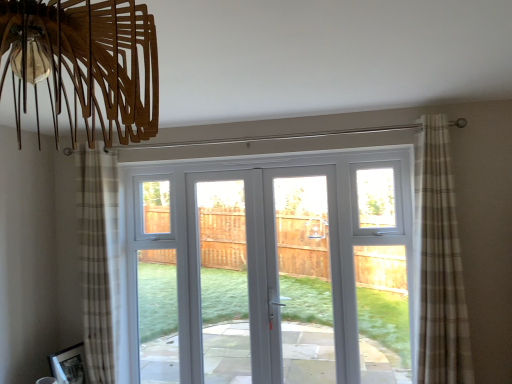
Where is `beige plaid curtain at left, the 1th curtain positioned from the back`? This screenshot has height=384, width=512. beige plaid curtain at left, the 1th curtain positioned from the back is located at coordinates (99, 259).

What is the approximate width of beige plaid curtain at right, arranged as the 2th curtain when viewed from the back?

beige plaid curtain at right, arranged as the 2th curtain when viewed from the back, is 10.49 inches wide.

Locate an element on the screen. The image size is (512, 384). white glossy door at center is located at coordinates (270, 269).

Which is correct: beige plaid curtain at right, positioned as the second curtain in left-to-right order, is inside beige plaid curtain at left, the first curtain positioned from the left, or outside of it?

beige plaid curtain at right, positioned as the second curtain in left-to-right order, is outside beige plaid curtain at left, the first curtain positioned from the left.

In the image, is beige plaid curtain at right, arranged as the 2th curtain when viewed from the back, positioned in front of or behind beige plaid curtain at left, which ranks as the 2th curtain in right-to-left order?

In the image, beige plaid curtain at right, arranged as the 2th curtain when viewed from the back, appears in front of beige plaid curtain at left, which ranks as the 2th curtain in right-to-left order.

Can you confirm if beige plaid curtain at right, arranged as the 2th curtain when viewed from the back, is positioned to the left of beige plaid curtain at left, which ranks as the 2th curtain in right-to-left order?

No, beige plaid curtain at right, arranged as the 2th curtain when viewed from the back, is not to the left of beige plaid curtain at left, which ranks as the 2th curtain in right-to-left order.

Considering the relative sizes of beige plaid curtain at right, acting as the first curtain starting from the front, and white glossy door at center in the image provided, is beige plaid curtain at right, acting as the first curtain starting from the front, smaller than white glossy door at center?

Yes, beige plaid curtain at right, acting as the first curtain starting from the front, is smaller than white glossy door at center.

From the picture: Can you confirm if beige plaid curtain at right, acting as the first curtain starting from the front, is thinner than white glossy door at center?

No, beige plaid curtain at right, acting as the first curtain starting from the front, is not thinner than white glossy door at center.

Between beige plaid curtain at right, arranged as the 2th curtain when viewed from the back, and white glossy door at center, which one appears on the right side from the viewer's perspective?

From the viewer's perspective, beige plaid curtain at right, arranged as the 2th curtain when viewed from the back, appears more on the right side.

Can beige plaid curtain at right, acting as the first curtain starting from the front, be found inside white glossy door at center?

No, beige plaid curtain at right, acting as the first curtain starting from the front, is located outside of white glossy door at center.

I want to click on door below the beige plaid curtain at right, arranged as the 2th curtain when viewed from the back (from a real-world perspective), so (x=270, y=269).

Is point (337, 219) closer to viewer compared to point (426, 249)?

No, it is behind (426, 249).

In the scene shown: Is white glossy door at center aimed at beige plaid curtain at left, the 2th curtain viewed from the front?

Yes, white glossy door at center is turned towards beige plaid curtain at left, the 2th curtain viewed from the front.

Considering the relative positions of white glossy door at center and beige plaid curtain at left, the first curtain positioned from the left, in the image provided, is white glossy door at center behind beige plaid curtain at left, the first curtain positioned from the left,?

Yes, it is.

Between white glossy door at center and beige plaid curtain at left, which ranks as the 2th curtain in right-to-left order, which one has larger size?

Bigger between the two is white glossy door at center.

Can you tell me how much beige plaid curtain at left, the 2th curtain viewed from the front, and white glossy door at center differ in facing direction?

The facing directions of beige plaid curtain at left, the 2th curtain viewed from the front, and white glossy door at center are 0.403 degrees apart.

Is point (106, 250) behind point (347, 310)?

No, it is not.

From the picture: Is beige plaid curtain at left, the first curtain positioned from the left, in front of or behind white glossy door at center in the image?

In the image, beige plaid curtain at left, the first curtain positioned from the left, appears in front of white glossy door at center.

Could you tell me if beige plaid curtain at left, which ranks as the 2th curtain in right-to-left order, is facing white glossy door at center?

No, beige plaid curtain at left, which ranks as the 2th curtain in right-to-left order, is not aimed at white glossy door at center.

Is beige plaid curtain at left, which ranks as the 2th curtain in right-to-left order, not close to beige plaid curtain at right, positioned as the second curtain in left-to-right order?

Indeed, beige plaid curtain at left, which ranks as the 2th curtain in right-to-left order, is not near beige plaid curtain at right, positioned as the second curtain in left-to-right order.

Could beige plaid curtain at right, which is counted as the first curtain, starting from the right, be considered to be inside beige plaid curtain at left, which ranks as the 2th curtain in right-to-left order?

Actually, beige plaid curtain at right, which is counted as the first curtain, starting from the right, is outside beige plaid curtain at left, which ranks as the 2th curtain in right-to-left order.

Visually, is beige plaid curtain at left, which ranks as the 2th curtain in right-to-left order, positioned to the left or to the right of beige plaid curtain at right, arranged as the 2th curtain when viewed from the back?

In the image, beige plaid curtain at left, which ranks as the 2th curtain in right-to-left order, appears on the left side of beige plaid curtain at right, arranged as the 2th curtain when viewed from the back.

This screenshot has width=512, height=384. I want to click on curtain that is in front of the beige plaid curtain at left, the 2th curtain viewed from the front, so click(439, 262).

Identify the location of door located on the left of beige plaid curtain at right, arranged as the 2th curtain when viewed from the back. (270, 269).

Estimate the real-world distances between objects in this image. Which object is closer to beige plaid curtain at right, acting as the first curtain starting from the front, beige plaid curtain at left, the 1th curtain positioned from the back, or white glossy door at center?

beige plaid curtain at left, the 1th curtain positioned from the back, lies closer to beige plaid curtain at right, acting as the first curtain starting from the front, than the other object.

Looking at the image, which one is located further to beige plaid curtain at left, the 2th curtain viewed from the front, beige plaid curtain at right, positioned as the second curtain in left-to-right order, or white glossy door at center?

white glossy door at center is further to beige plaid curtain at left, the 2th curtain viewed from the front.

Considering their positions, is beige plaid curtain at right, positioned as the second curtain in left-to-right order, positioned closer to white glossy door at center than beige plaid curtain at left, the first curtain positioned from the left?

Among the two, beige plaid curtain at right, positioned as the second curtain in left-to-right order, is located nearer to white glossy door at center.

Based on their spatial positions, is beige plaid curtain at left, the first curtain positioned from the left, or beige plaid curtain at right, acting as the first curtain starting from the front, further from white glossy door at center?

The object further to white glossy door at center is beige plaid curtain at left, the first curtain positioned from the left.

Considering their positions, is white glossy door at center positioned further to beige plaid curtain at left, the 2th curtain viewed from the front, than beige plaid curtain at right, positioned as the second curtain in left-to-right order?

white glossy door at center.

Based on their spatial positions, is white glossy door at center or beige plaid curtain at left, the first curtain positioned from the left, further from beige plaid curtain at right, acting as the first curtain starting from the front?

white glossy door at center is further to beige plaid curtain at right, acting as the first curtain starting from the front.

The height and width of the screenshot is (384, 512). Find the location of `door situated between beige plaid curtain at left, the first curtain positioned from the left, and beige plaid curtain at right, arranged as the 2th curtain when viewed from the back, from left to right`. door situated between beige plaid curtain at left, the first curtain positioned from the left, and beige plaid curtain at right, arranged as the 2th curtain when viewed from the back, from left to right is located at coordinates (270, 269).